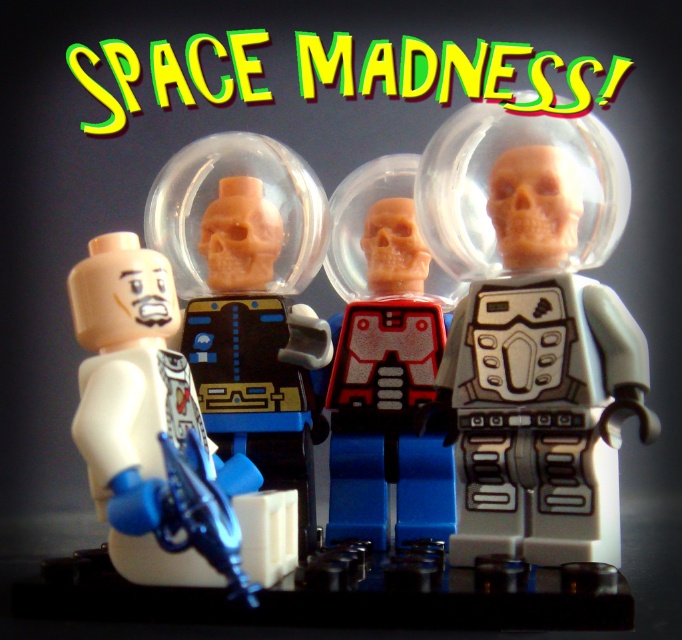
Question: Is translucent plastic astronaut at center to the left of white matte astronaut at left from the viewer's perspective?

Choices:
 (A) yes
 (B) no

Answer: (B)

Question: Which of the following is the closest to the observer?

Choices:
 (A) light gray plastic astronaut at center
 (B) translucent plastic astronaut at center
 (C) white matte astronaut at left

Answer: (C)

Question: Which object is the closest to the translucent plastic astronaut at center?

Choices:
 (A) white matte astronaut at left
 (B) light gray plastic astronaut at center

Answer: (A)

Question: Observing the image, what is the correct spatial positioning of matte black astronaut at center in reference to translucent plastic astronaut at center?

Choices:
 (A) right
 (B) left

Answer: (A)

Question: Can you confirm if matte black astronaut at center is bigger than white matte astronaut at left?

Choices:
 (A) no
 (B) yes

Answer: (B)

Question: Among these points, which one is nearest to the camera?

Choices:
 (A) (524, 428)
 (B) (321, 355)

Answer: (A)